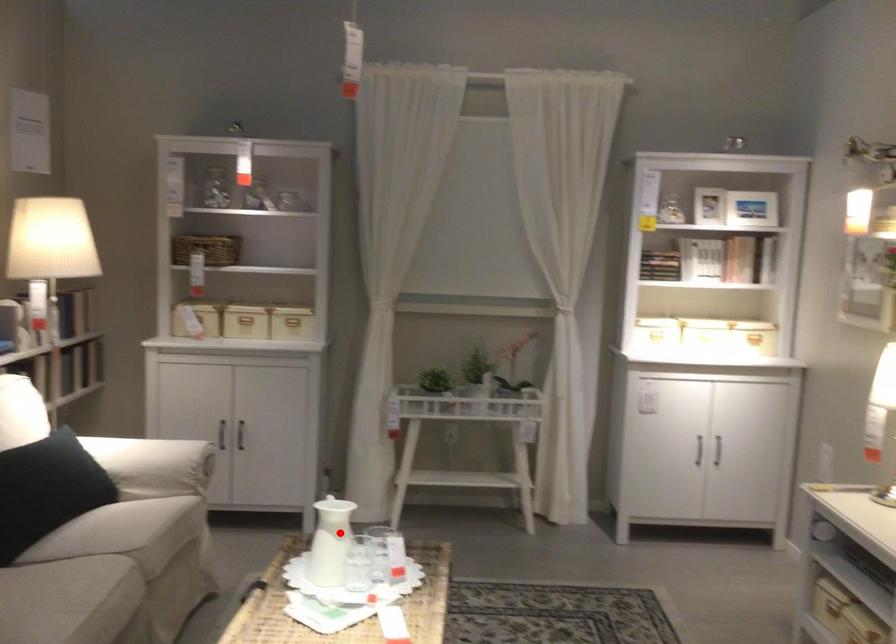
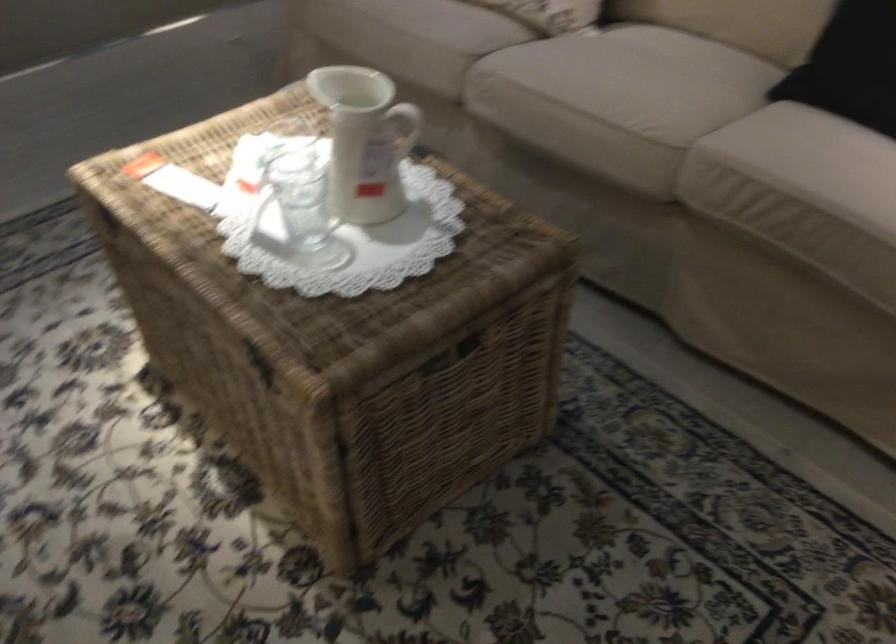
Question: A red point is marked in image1. In image2, is the corresponding 3D point closer to the camera or farther? Reply with the corresponding letter.

Choices:
 (A) The corresponding 3D point is closer.
 (B) The corresponding 3D point is farther.

Answer: (A)